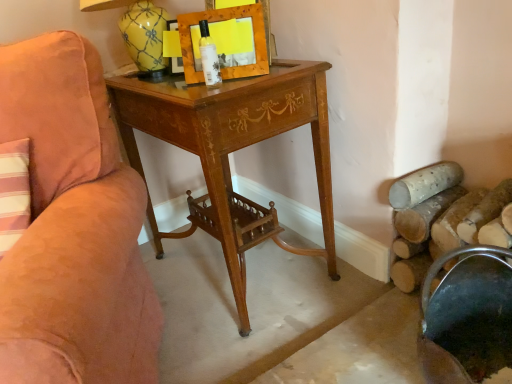
What are the coordinates of `vacant space in wooden desk at center (from a real-world perspective)` in the screenshot? It's located at (248, 270).